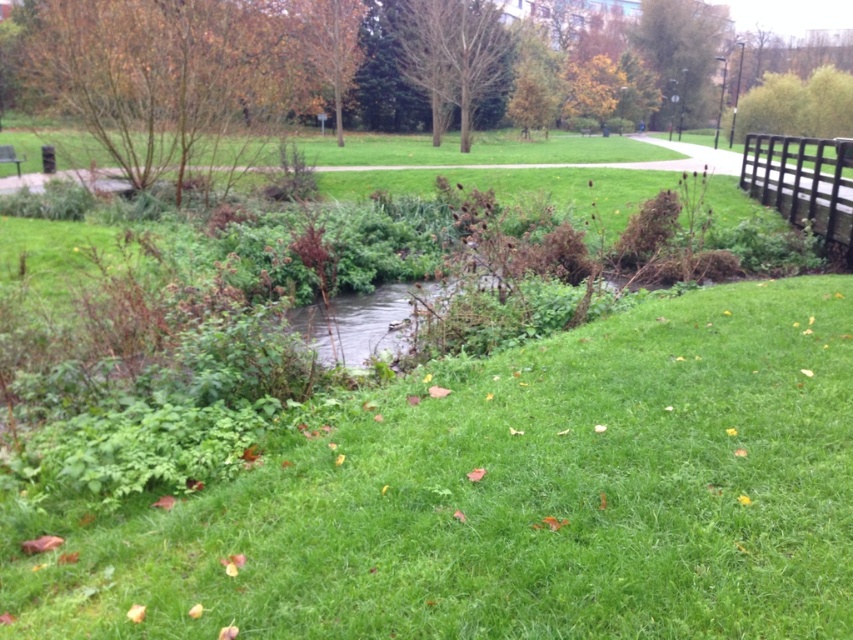
Can you confirm if brown wooden fence at upper right is bigger than green leafy tree at upper center?

No.

Which is behind, point (746, 179) or point (656, 44)?

Positioned behind is point (656, 44).

This screenshot has width=853, height=640. I want to click on brown wooden fence at upper right, so click(804, 182).

Can you confirm if brown leafy tree at upper left is positioned to the right of bare wood tree at center?

In fact, brown leafy tree at upper left is to the left of bare wood tree at center.

Does brown leafy tree at upper left have a smaller size compared to bare wood tree at center?

Actually, brown leafy tree at upper left might be larger than bare wood tree at center.

Between point (96, 29) and point (480, 42), which one is positioned behind?

The point (480, 42) is more distant.

Where is `brown leafy tree at upper left`? The height and width of the screenshot is (640, 853). brown leafy tree at upper left is located at coordinates (171, 77).

Is brown leafy tree at upper left to the right of green leafy tree at upper center from the viewer's perspective?

Incorrect, brown leafy tree at upper left is not on the right side of green leafy tree at upper center.

Between brown leafy tree at upper left and green leafy tree at upper center, which one is positioned higher?

Positioned higher is green leafy tree at upper center.

This screenshot has height=640, width=853. In order to click on brown leafy tree at upper left in this screenshot , I will do `click(171, 77)`.